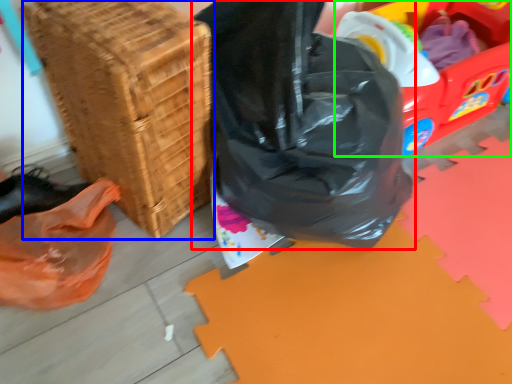
Question: Which object is positioned closest to plastic bag (highlighted by a red box)? Select from basket (highlighted by a blue box) and wagon (highlighted by a green box).

Choices:
 (A) basket
 (B) wagon

Answer: (A)